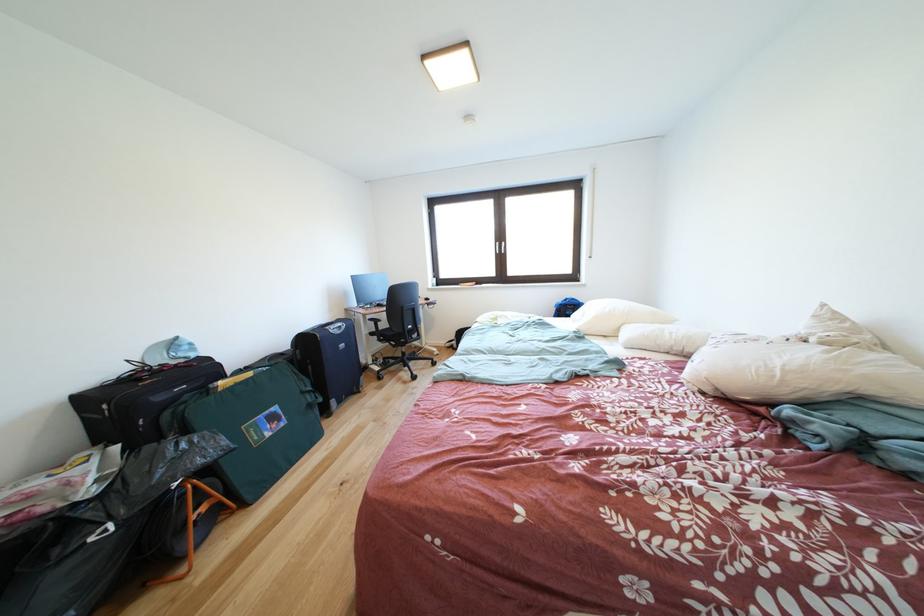
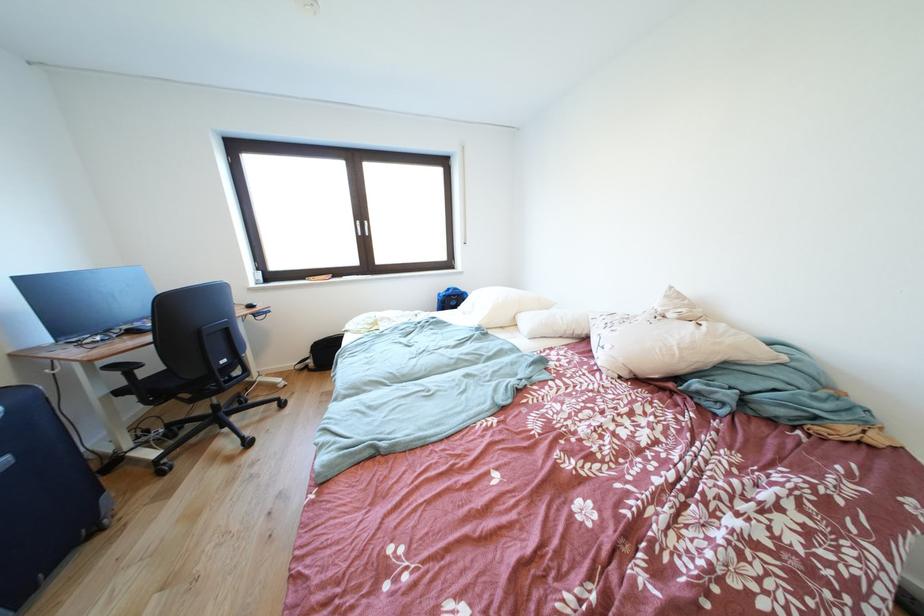
The point at (x=350, y=350) is marked in the first image. Where is the corresponding point in the second image?

(8, 468)